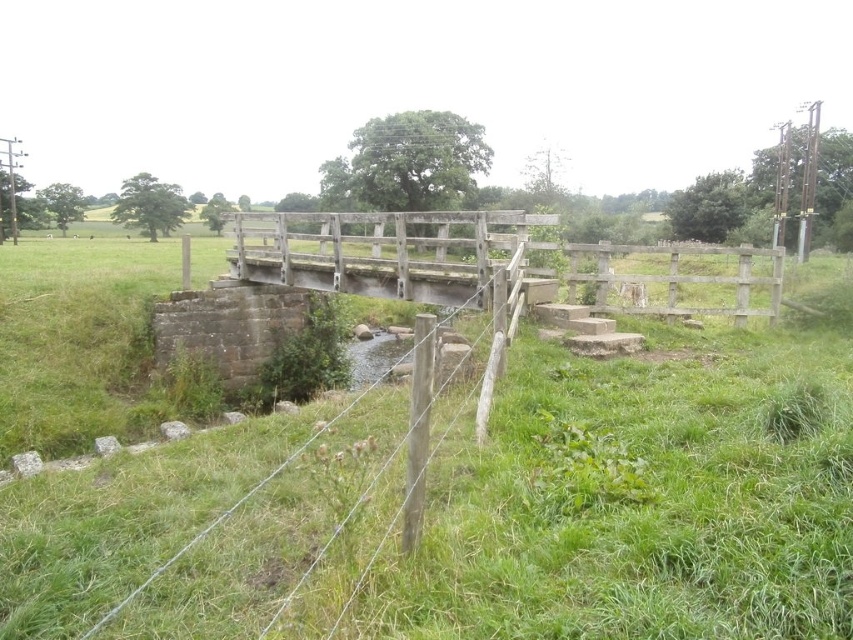
You are a gardener planning to mow the green grassy at center and the wooden fence at center. Which area requires more time to mow based on their sizes?

The green grassy at center requires more time to mow since it has a larger size compared to the wooden fence at center.